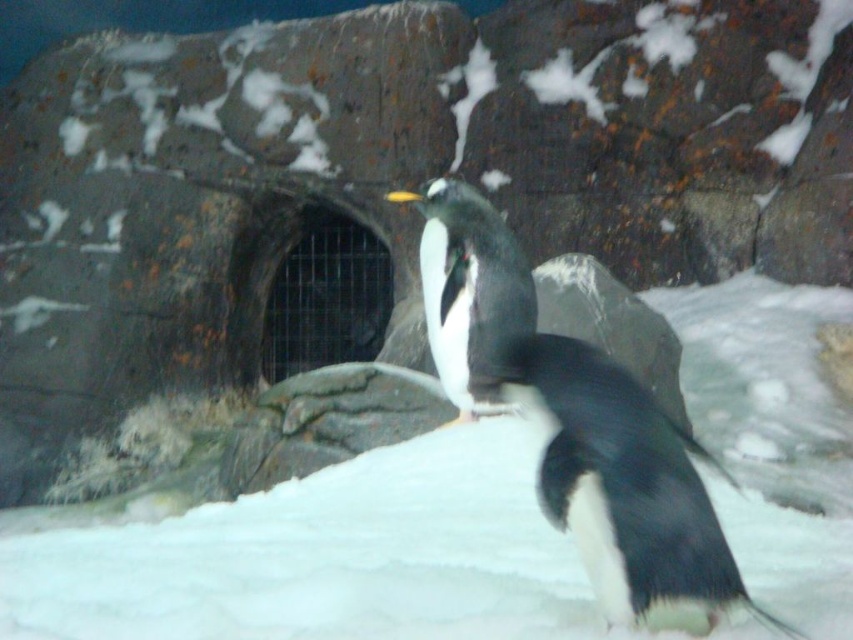
You are observing two points in the penguin habitat scene. The first point is at coordinates point (614, 444) and the second is at point (483, 198). Which point is nearer to you?

Point (614, 444) is closer to the viewer than point (483, 198).

You are a penguin trainer observing the penguins in their habitat. You notice the white fluffy snow at center and the black matte penguin at center. Which object is wider?

The white fluffy snow at center is wider than the black matte penguin at center.